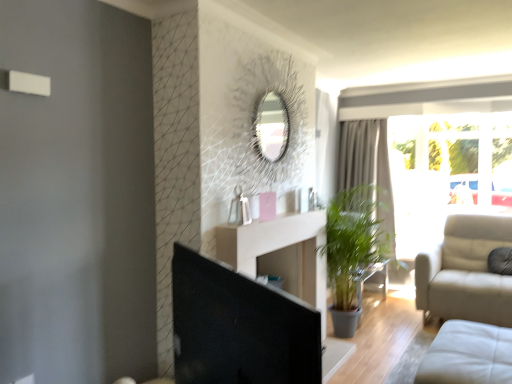
What is the approximate width of white leather studio couch at lower right?

white leather studio couch at lower right is 1.05 meters in width.

The image size is (512, 384). I want to click on black glossy screen door at center, so click(x=239, y=328).

Identify the location of transparent glass window at right. (426, 98).

From the image's perspective, is gray fabric curtain at center located beneath white leather studio couch at lower right?

No, from the image's perspective, gray fabric curtain at center is not below white leather studio couch at lower right.

Can you confirm if gray fabric curtain at center is thinner than white leather studio couch at lower right?

Yes, gray fabric curtain at center is thinner than white leather studio couch at lower right.

Is gray fabric curtain at center completely or partially outside of white leather studio couch at lower right?

Yes.

Who is smaller, transparent glass window at right or gray fabric curtain at center?

With smaller size is gray fabric curtain at center.

Considering the sizes of objects transparent glass window at right and gray fabric curtain at center in the image provided, who is taller, transparent glass window at right or gray fabric curtain at center?

With more height is gray fabric curtain at center.

Based on the photo, considering the relative positions of transparent glass window at right and gray fabric curtain at center in the image provided, is transparent glass window at right to the left of gray fabric curtain at center from the viewer's perspective?

Incorrect, transparent glass window at right is not on the left side of gray fabric curtain at center.

From the image's perspective, is transparent glass window at right under white leather studio couch at lower right?

Incorrect, from the image's perspective, transparent glass window at right is higher than white leather studio couch at lower right.

Does transparent glass window at right turn towards white leather studio couch at lower right?

Yes, transparent glass window at right faces towards white leather studio couch at lower right.

From their relative heights in the image, would you say transparent glass window at right is taller or shorter than white leather studio couch at lower right?

transparent glass window at right is taller than white leather studio couch at lower right.

Are transparent glass window at right and black glossy screen door at center beside each other?

No, transparent glass window at right is not beside black glossy screen door at center.

In terms of size, does transparent glass window at right appear bigger or smaller than black glossy screen door at center?

Considering their sizes, transparent glass window at right takes up more space than black glossy screen door at center.

Which is farther, (381, 103) or (229, 353)?

The point (381, 103) is farther.

From the picture: Considering the sizes of transparent glass window at right and black glossy screen door at center in the image, is transparent glass window at right taller or shorter than black glossy screen door at center?

Clearly, transparent glass window at right is taller compared to black glossy screen door at center.

In order to click on screen door directly beneath the gray fabric curtain at center (from a real-world perspective) in this screenshot , I will do click(x=239, y=328).

Is gray fabric curtain at center inside black glossy screen door at center?

No, gray fabric curtain at center is not surrounded by black glossy screen door at center.

Are black glossy screen door at center and gray fabric curtain at center far apart?

That's right, there is a large distance between black glossy screen door at center and gray fabric curtain at center.

Which is closer, (290,310) or (378,128)?

Point (290,310) appears to be closer to the viewer than point (378,128).

Consider the image. From their relative heights in the image, would you say white leather studio couch at lower right is taller or shorter than transparent glass window at right?

Considering their sizes, white leather studio couch at lower right has less height than transparent glass window at right.

This screenshot has height=384, width=512. Identify the location of studio couch in front of the transparent glass window at right. (468, 354).

Would you say white leather studio couch at lower right is inside or outside transparent glass window at right?

white leather studio couch at lower right exists outside the volume of transparent glass window at right.

From a real-world perspective, is white leather studio couch at lower right below transparent glass window at right?

Correct, in the physical world, white leather studio couch at lower right is lower than transparent glass window at right.

Is point (392, 227) farther from viewer compared to point (294, 377)?

Yes, it is.

From a real-world perspective, is gray fabric curtain at center below black glossy screen door at center?

No.

Which object is positioned more to the left, gray fabric curtain at center or black glossy screen door at center?

From the viewer's perspective, black glossy screen door at center appears more on the left side.

In order to click on curtain above the white leather studio couch at lower right (from the image's perspective) in this screenshot , I will do `click(368, 169)`.

This screenshot has height=384, width=512. What are the coordinates of `curtain that appears on the left of transparent glass window at right` in the screenshot? It's located at (368, 169).

From the image, which object appears to be farther from black glossy screen door at center, white leather studio couch at lower right or gray fabric curtain at center?

gray fabric curtain at center.

Which object lies nearer to the anchor point transparent glass window at right, black glossy screen door at center or white leather studio couch at lower right?

Among the two, white leather studio couch at lower right is located nearer to transparent glass window at right.

When comparing their distances from white leather studio couch at lower right, does gray fabric curtain at center or black glossy screen door at center seem closer?

The object closer to white leather studio couch at lower right is black glossy screen door at center.

From the image, which object appears to be nearer to gray fabric curtain at center, black glossy screen door at center or transparent glass window at right?

transparent glass window at right.

Which object lies nearer to the anchor point gray fabric curtain at center, white leather studio couch at lower right or black glossy screen door at center?

Based on the image, white leather studio couch at lower right appears to be nearer to gray fabric curtain at center.

Which object lies nearer to the anchor point black glossy screen door at center, gray fabric curtain at center or white leather studio couch at lower right?

white leather studio couch at lower right.

Considering their positions, is gray fabric curtain at center positioned closer to white leather studio couch at lower right than transparent glass window at right?

Among the two, transparent glass window at right is located nearer to white leather studio couch at lower right.

Which object lies nearer to the anchor point transparent glass window at right, white leather studio couch at lower right or black glossy screen door at center?

The object closer to transparent glass window at right is white leather studio couch at lower right.

The image size is (512, 384). I want to click on window between white leather studio couch at lower right and gray fabric curtain at center in the front-back direction, so click(x=426, y=98).

Where is `studio couch located between black glossy screen door at center and transparent glass window at right in the depth direction`? The height and width of the screenshot is (384, 512). studio couch located between black glossy screen door at center and transparent glass window at right in the depth direction is located at coordinates (468, 354).

Locate an element on the screen. This screenshot has width=512, height=384. studio couch located between black glossy screen door at center and gray fabric curtain at center in the depth direction is located at coordinates (468, 354).

The height and width of the screenshot is (384, 512). Identify the location of window between black glossy screen door at center and gray fabric curtain at center from front to back. (426, 98).